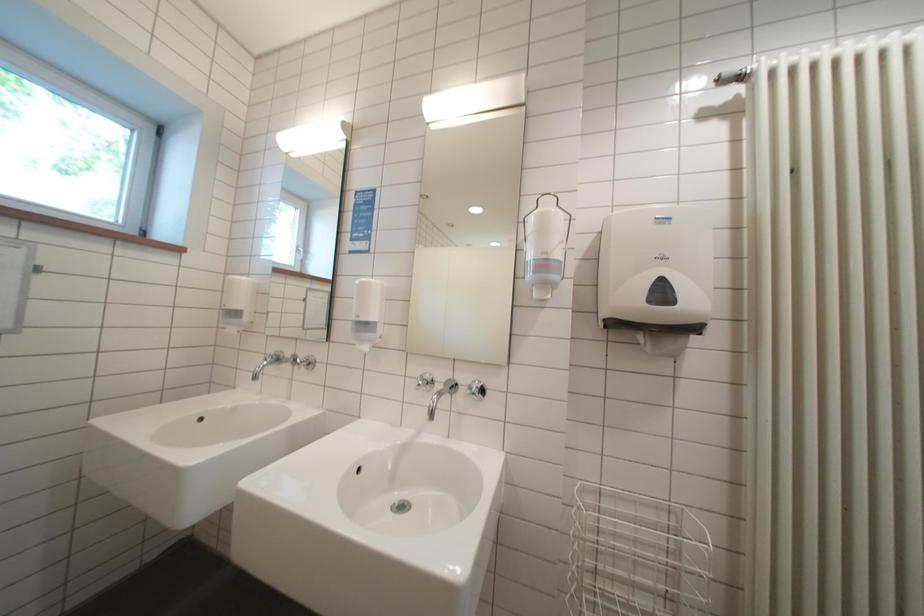
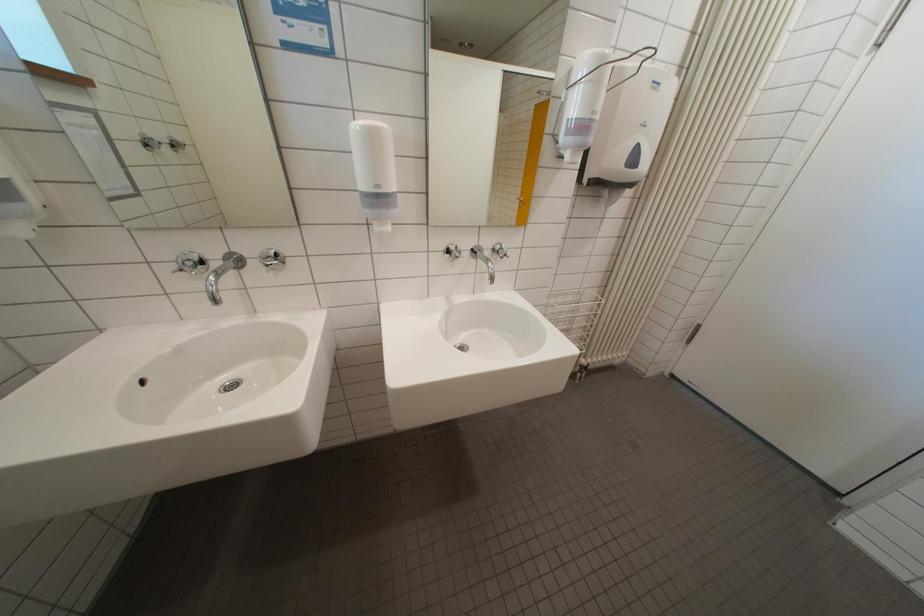
The first image is from the beginning of the video and the second image is from the end. How did the camera likely rotate when shooting the video?

The camera rotated toward right-down.